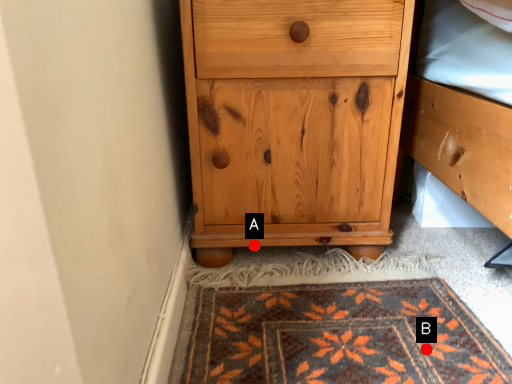
Question: Two points are circled on the image, labeled by A and B beside each circle. Which point is closer to the camera?

Choices:
 (A) A is closer
 (B) B is closer

Answer: (B)